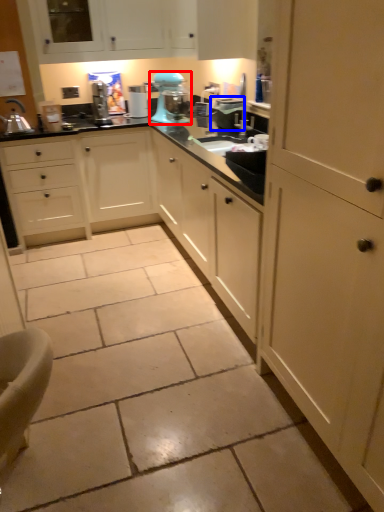
Question: Which object is further to the camera taking this photo, home appliance (highlighted by a red box) or appliance (highlighted by a blue box)?

Choices:
 (A) home appliance
 (B) appliance

Answer: (A)